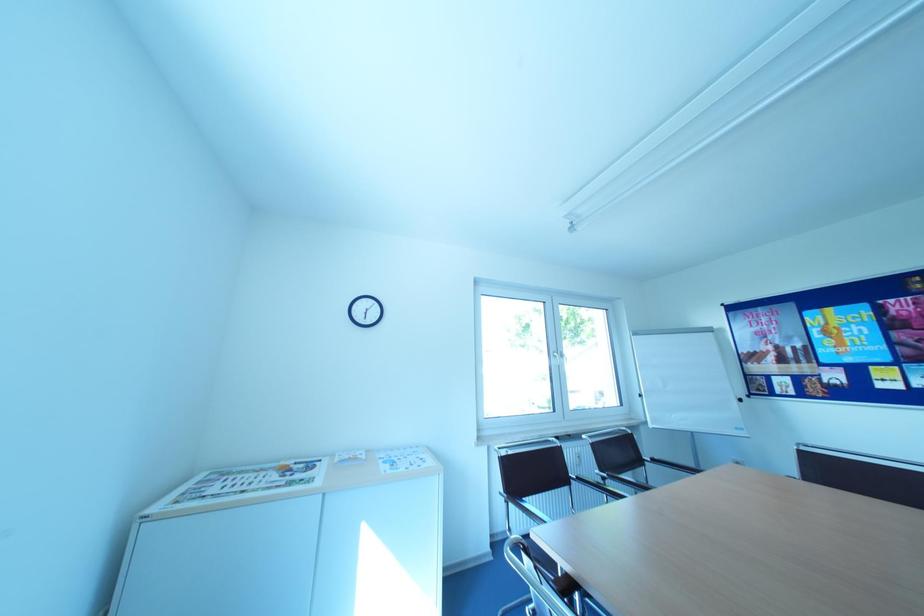
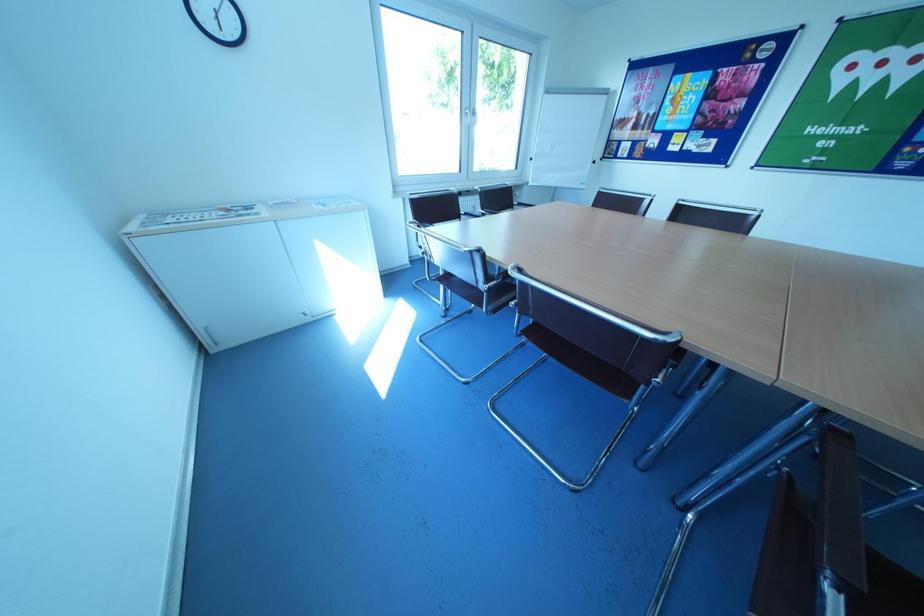
The first image is from the beginning of the video and the second image is from the end. How did the camera likely rotate when shooting the video?

The rotation direction of the camera is right-down.